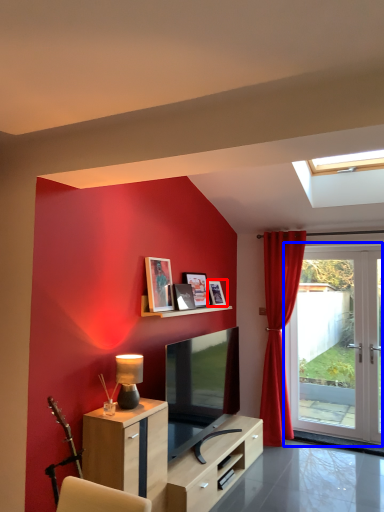
Question: Which point is closer to the camera, picture frame (highlighted by a red box) or door (highlighted by a blue box)?

Choices:
 (A) picture frame
 (B) door

Answer: (A)